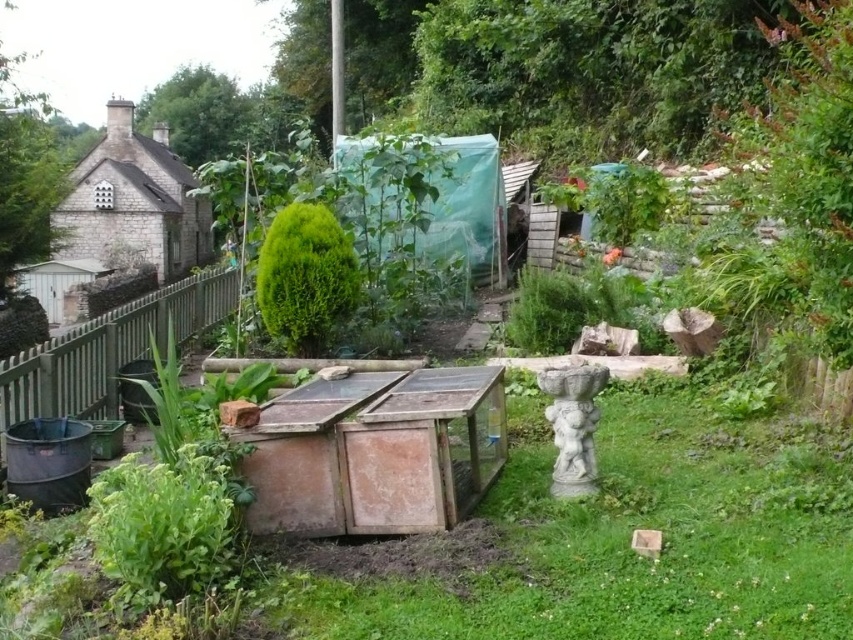
You are standing in the garden and want to find the green wooden fence at lower left. According to the coordinates provided, where should you look relative to your current position?

The green wooden fence at lower left is located at point coordinates, so you should look towards the lower left direction from your current position to find it.

You are a gardener who needs to water the green leafy bush at center. You have a watering can that can reach 5 feet. If you stand at the green wooden fence at lower left, can you reach the bush with the watering can?

The green wooden fence at lower left is 4.68 feet away from the green leafy bush at center. Since the watering can can reach 5 feet, you can water the bush from the fence.

You are standing in the garden and want to move from the green wooden fence at lower left to the green leafy bush at center. Which direction should you move to reach the bush?

To reach the green leafy bush at center from the green wooden fence at lower left, you should move to the right since the green wooden fence at lower left is positioned on the left side of the green leafy bush at center.